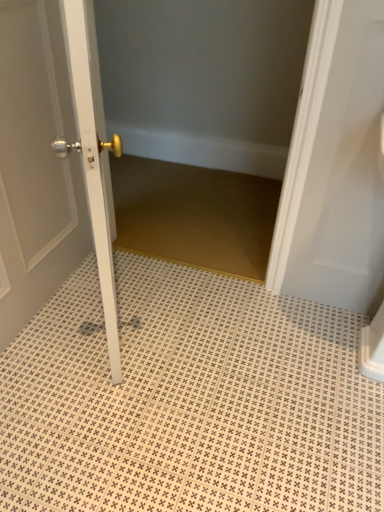
Question: In the image, is white textured tile at center on the left side or the right side of white glossy door at center?

Choices:
 (A) right
 (B) left

Answer: (A)

Question: Does point (259, 458) appear closer or farther from the camera than point (11, 52)?

Choices:
 (A) closer
 (B) farther

Answer: (B)

Question: Do you think white textured tile at center is within white glossy door at center, or outside of it?

Choices:
 (A) inside
 (B) outside

Answer: (B)

Question: From a real-world perspective, is white glossy door at center physically located above or below white textured tile at center?

Choices:
 (A) above
 (B) below

Answer: (A)

Question: In the image, is white glossy door at center on the left side or the right side of white textured tile at center?

Choices:
 (A) right
 (B) left

Answer: (B)

Question: Is point (13, 189) positioned closer to the camera than point (352, 377)?

Choices:
 (A) closer
 (B) farther

Answer: (A)

Question: In the image, is white glossy door at center positioned in front of or behind white textured tile at center?

Choices:
 (A) front
 (B) behind

Answer: (A)